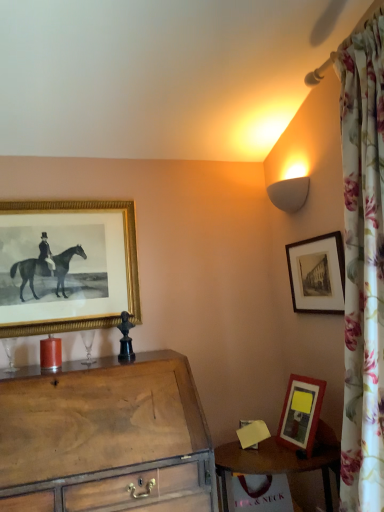
This screenshot has height=512, width=384. What are the coordinates of `free point above wooden table at lower right (from a real-world perspective)` in the screenshot? It's located at (285, 453).